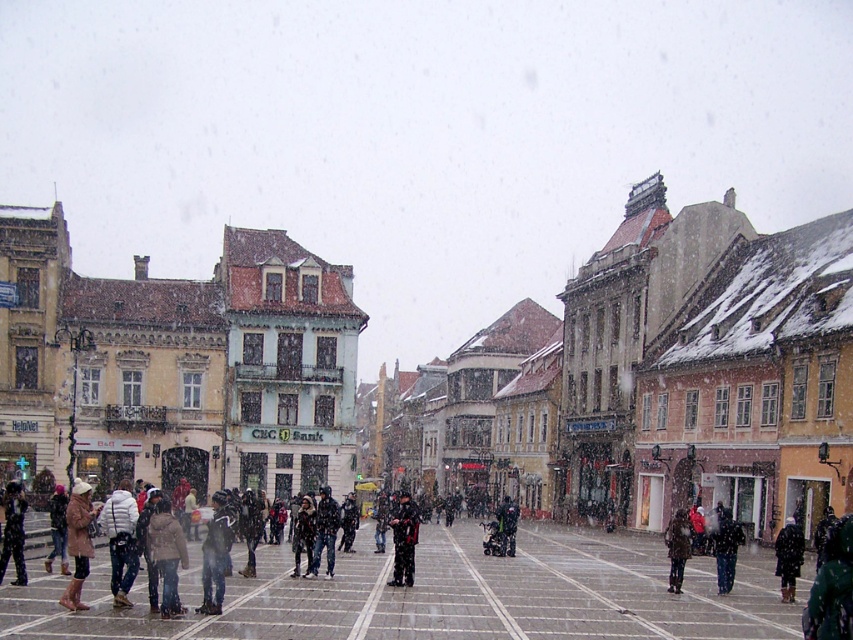
You are a pedestrian standing in the square and see both the black leather jacket at center and the dark gray fabric jacket at center. Which jacket is positioned lower in the image?

The black leather jacket at center is positioned lower because it is below the dark gray fabric jacket at center.

You are standing at the center of the square and want to find the tan suede coat at lower left. Which direction should you look to locate it?

You should look to the lower left direction to locate the tan suede coat at lower left.

You are standing at point (213, 582) in the square and want to walk to the entrance of CEC Bank, which is located behind point (173, 307). Is there a clear path between your current position and the bank entrance?

Yes, since point (173, 307) is behind point (213, 582), you can walk directly towards it without any obstructions.